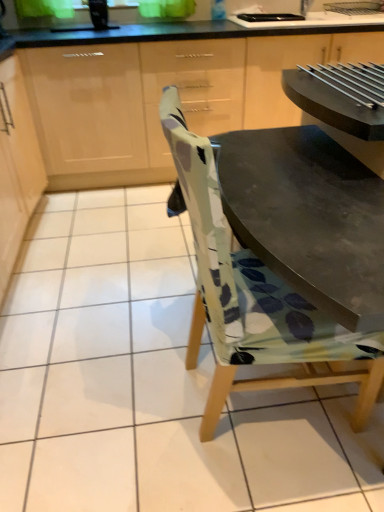
Question: Is matte wood cabinets at upper center, the first cabinetry positioned from the right, oriented away from light wood cabinet at upper left, arranged as the 2th cabinetry when viewed from the right?

Choices:
 (A) yes
 (B) no

Answer: (B)

Question: Is the depth of matte wood cabinets at upper center, placed as the 2th cabinetry when sorted from left to right, greater than that of light wood cabinet at upper left, arranged as the 2th cabinetry when viewed from the right?

Choices:
 (A) no
 (B) yes

Answer: (B)

Question: Considering the relative sizes of matte wood cabinets at upper center, the first cabinetry positioned from the right, and light wood cabinet at upper left, arranged as the 2th cabinetry when viewed from the right, in the image provided, is matte wood cabinets at upper center, the first cabinetry positioned from the right, smaller than light wood cabinet at upper left, arranged as the 2th cabinetry when viewed from the right,?

Choices:
 (A) yes
 (B) no

Answer: (B)

Question: Are matte wood cabinets at upper center, the first cabinetry positioned from the right, and light wood cabinet at upper left, arranged as the 2th cabinetry when viewed from the right, making contact?

Choices:
 (A) no
 (B) yes

Answer: (A)

Question: Does matte wood cabinets at upper center, placed as the 2th cabinetry when sorted from left to right, appear on the right side of light wood cabinet at upper left, the 1th cabinetry positioned from the left?

Choices:
 (A) yes
 (B) no

Answer: (A)

Question: From a real-world perspective, is light wood cabinet at upper left, the 1th cabinetry positioned from the left, physically located above or below printed fabric chair at center?

Choices:
 (A) below
 (B) above

Answer: (A)

Question: Is point (1, 165) positioned closer to the camera than point (178, 156)?

Choices:
 (A) farther
 (B) closer

Answer: (A)

Question: Is light wood cabinet at upper left, arranged as the 2th cabinetry when viewed from the right, bigger or smaller than printed fabric chair at center?

Choices:
 (A) small
 (B) big

Answer: (B)

Question: Relative to printed fabric chair at center, is light wood cabinet at upper left, arranged as the 2th cabinetry when viewed from the right, in front or behind?

Choices:
 (A) front
 (B) behind

Answer: (B)

Question: Considering the positions of matte wood cabinets at upper center, the first cabinetry positioned from the right, and light wood cabinet at upper left, the 1th cabinetry positioned from the left, in the image, is matte wood cabinets at upper center, the first cabinetry positioned from the right, taller or shorter than light wood cabinet at upper left, the 1th cabinetry positioned from the left,?

Choices:
 (A) short
 (B) tall

Answer: (B)

Question: Is matte wood cabinets at upper center, the first cabinetry positioned from the right, bigger or smaller than light wood cabinet at upper left, arranged as the 2th cabinetry when viewed from the right?

Choices:
 (A) small
 (B) big

Answer: (B)

Question: Is matte wood cabinets at upper center, placed as the 2th cabinetry when sorted from left to right, to the left or to the right of light wood cabinet at upper left, the 1th cabinetry positioned from the left, in the image?

Choices:
 (A) left
 (B) right

Answer: (B)

Question: Choose the correct answer: Is matte wood cabinets at upper center, placed as the 2th cabinetry when sorted from left to right, inside light wood cabinet at upper left, the 1th cabinetry positioned from the left, or outside it?

Choices:
 (A) inside
 (B) outside

Answer: (B)

Question: Does point (251, 287) appear closer or farther from the camera than point (64, 176)?

Choices:
 (A) closer
 (B) farther

Answer: (A)

Question: Is printed fabric chair at center taller or shorter than matte wood cabinets at upper center, placed as the 2th cabinetry when sorted from left to right?

Choices:
 (A) short
 (B) tall

Answer: (B)